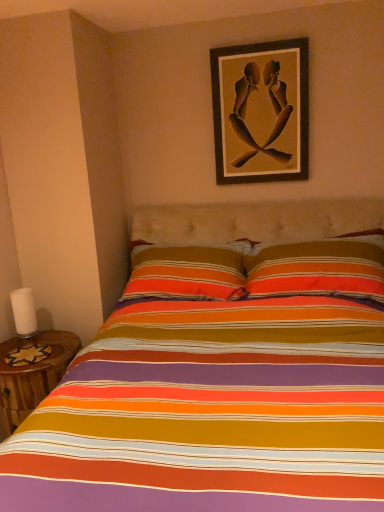
Question: Is wooden table at lower left wider or thinner than white matte candle at left?

Choices:
 (A) wide
 (B) thin

Answer: (A)

Question: Considering the relative positions of wooden table at lower left and white matte candle at left in the image provided, is wooden table at lower left to the left or to the right of white matte candle at left?

Choices:
 (A) right
 (B) left

Answer: (A)

Question: Which object is the closest to the wooden picture frame at upper center?

Choices:
 (A) white matte candle at left
 (B) wooden table at lower left

Answer: (B)

Question: Based on their relative distances, which object is farther from the white matte candle at left?

Choices:
 (A) wooden picture frame at upper center
 (B) wooden table at lower left

Answer: (A)